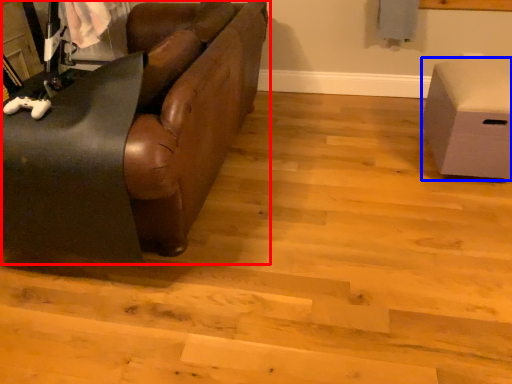
Question: Which object is closer to the camera taking this photo, studio couch (highlighted by a red box) or furniture (highlighted by a blue box)?

Choices:
 (A) studio couch
 (B) furniture

Answer: (A)